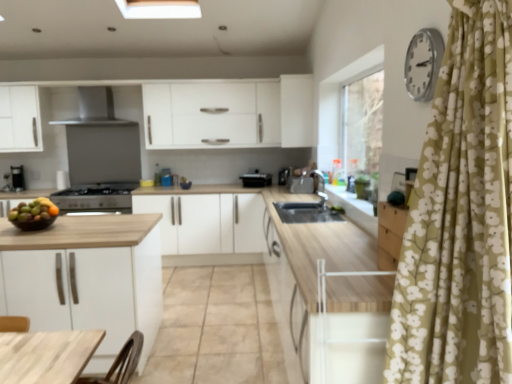
Question: From a real-world perspective, does wooden countertop at center sit lower than satin silver sink at center, positioned as the 3th appliance in left-to-right order?

Choices:
 (A) no
 (B) yes

Answer: (B)

Question: Does wooden countertop at center appear on the right side of satin silver sink at center, placed as the 1th appliance when sorted from right to left?

Choices:
 (A) no
 (B) yes

Answer: (A)

Question: Does wooden countertop at center have a lesser width compared to satin silver sink at center, positioned as the 3th appliance in left-to-right order?

Choices:
 (A) no
 (B) yes

Answer: (A)

Question: Is wooden countertop at center at the left side of satin silver sink at center, placed as the 1th appliance when sorted from right to left?

Choices:
 (A) no
 (B) yes

Answer: (B)

Question: Considering the relative sizes of wooden countertop at center and satin silver sink at center, placed as the 1th appliance when sorted from right to left, in the image provided, is wooden countertop at center wider than satin silver sink at center, placed as the 1th appliance when sorted from right to left,?

Choices:
 (A) no
 (B) yes

Answer: (B)

Question: From the image's perspective, is wooden countertop at center beneath satin silver sink at center, placed as the 1th appliance when sorted from right to left?

Choices:
 (A) no
 (B) yes

Answer: (B)

Question: From the image's perspective, is black plastic toaster at center, marked as the second appliance in a left-to-right arrangement, on top of wooden countertop at center?

Choices:
 (A) no
 (B) yes

Answer: (B)

Question: From a real-world perspective, does black plastic toaster at center, marked as the second appliance in a left-to-right arrangement, sit lower than wooden countertop at center?

Choices:
 (A) no
 (B) yes

Answer: (A)

Question: Is black plastic toaster at center, marked as the second appliance in a left-to-right arrangement, not near wooden countertop at center?

Choices:
 (A) yes
 (B) no

Answer: (A)

Question: Considering the relative positions of black plastic toaster at center, marked as the second appliance in a left-to-right arrangement, and wooden countertop at center in the image provided, is black plastic toaster at center, marked as the second appliance in a left-to-right arrangement, to the right of wooden countertop at center from the viewer's perspective?

Choices:
 (A) no
 (B) yes

Answer: (B)

Question: Is wooden countertop at center located within black plastic toaster at center, marked as the 2th appliance in a right-to-left arrangement?

Choices:
 (A) no
 (B) yes

Answer: (A)

Question: Is black plastic toaster at center, marked as the second appliance in a left-to-right arrangement, in front of wooden countertop at center?

Choices:
 (A) yes
 (B) no

Answer: (B)

Question: Is white matte cabinet at upper center, the first cabinetry positioned from the top, further to the viewer compared to black plastic toaster at center, marked as the 2th appliance in a right-to-left arrangement?

Choices:
 (A) yes
 (B) no

Answer: (B)